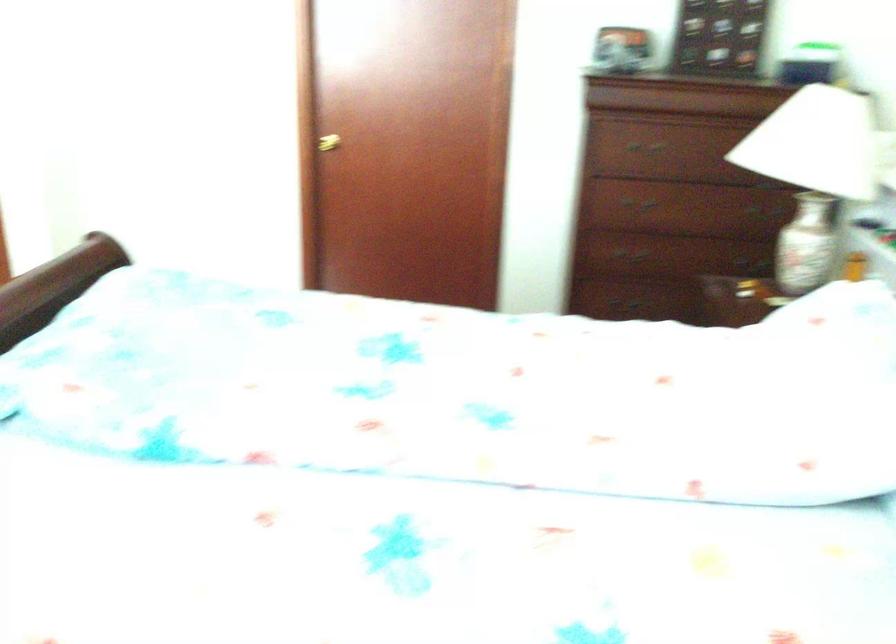
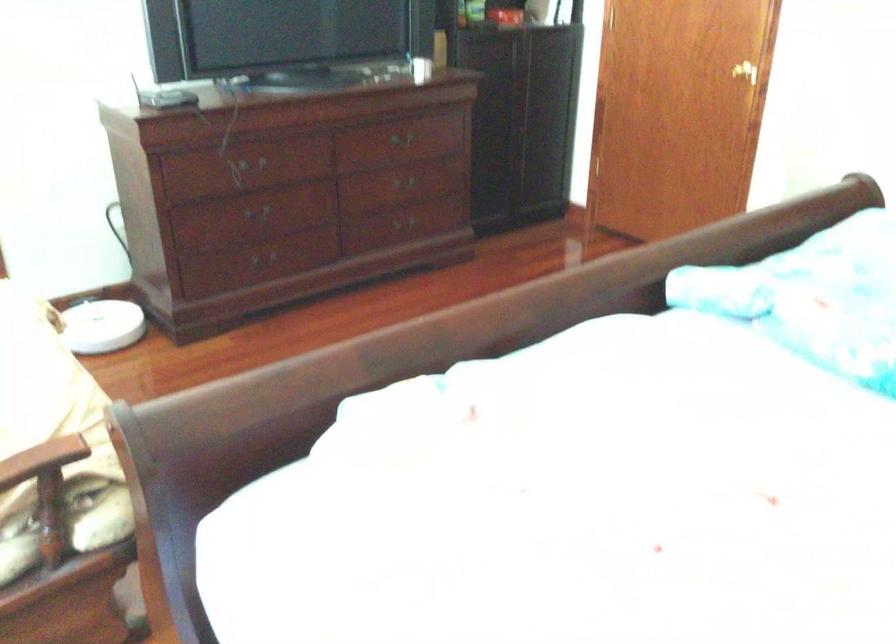
Question: The camera is either moving clockwise (left) or counter-clockwise (right) around the object. The first image is from the beginning of the video and the second image is from the end. Is the camera moving left or right when shooting the video?

Choices:
 (A) Left
 (B) Right

Answer: (B)